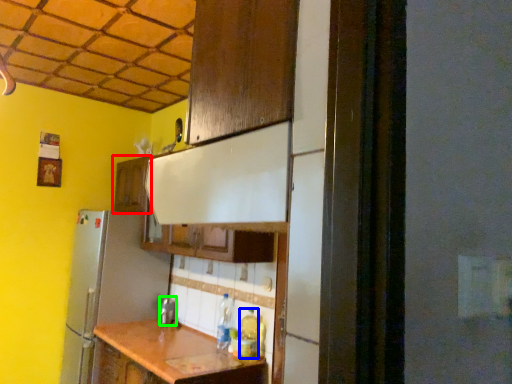
Question: Which object is the farthest from cabinetry (highlighted by a red box)? Choose among these: bottle (highlighted by a blue box) or silver (highlighted by a green box).

Choices:
 (A) bottle
 (B) silver

Answer: (A)